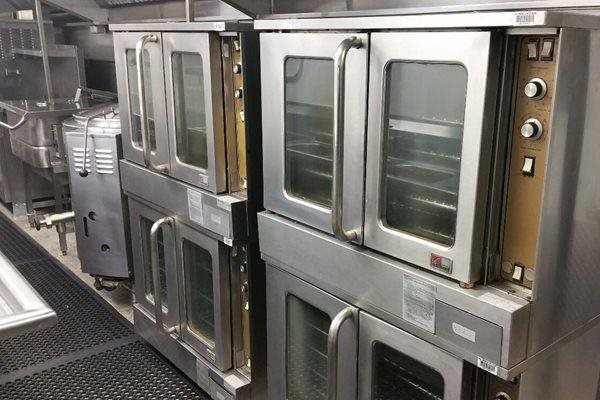
Image resolution: width=600 pixels, height=400 pixels. Find the location of `space between ovens`. space between ovens is located at coordinates (257, 169).